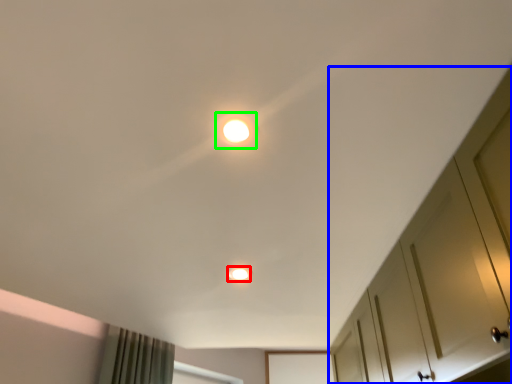
Question: Estimate the real-world distances between objects in this image. Which object is farther from dot (highlighted by a red box), dresser (highlighted by a blue box) or dot (highlighted by a green box)?

Choices:
 (A) dresser
 (B) dot

Answer: (B)